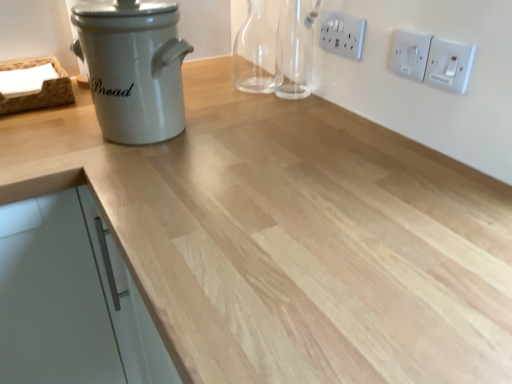
Question: Is white ceramic bread bin at left situated inside transparent glass bottle at upper center or outside?

Choices:
 (A) inside
 (B) outside

Answer: (B)

Question: Based on their sizes in the image, would you say white ceramic bread bin at left is bigger or smaller than transparent glass bottle at upper center?

Choices:
 (A) big
 (B) small

Answer: (A)

Question: Estimate the real-world distances between objects in this image. Which object is closer to the white ceramic bread bin at left?

Choices:
 (A) white plastic switch at upper right, which ranks as the 1th electric outlet in right-to-left order
 (B) transparent glass bottle at upper center
 (C) white plastic switch at upper right, the 2th electric outlet when ordered from right to left
 (D) white matte cabinet handle at left
 (E) white plastic electric outlet at upper right, positioned as the first electric outlet in left-to-right order

Answer: (D)

Question: Considering the real-world distances, which object is closest to the white ceramic bread bin at left?

Choices:
 (A) white plastic switch at upper right, which ranks as the 1th electric outlet in right-to-left order
 (B) white matte cabinet handle at left
 (C) white plastic electric outlet at upper right, which is counted as the third electric outlet, starting from the right
 (D) wooden tray at left
 (E) white plastic switch at upper right, placed as the second electric outlet when sorted from left to right

Answer: (D)